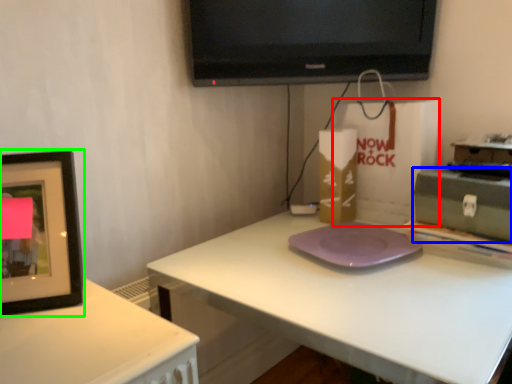
Question: Considering the real-world distances, which object is closest to paper bag (highlighted by a red box)? box (highlighted by a blue box) or picture frame (highlighted by a green box).

Choices:
 (A) box
 (B) picture frame

Answer: (A)